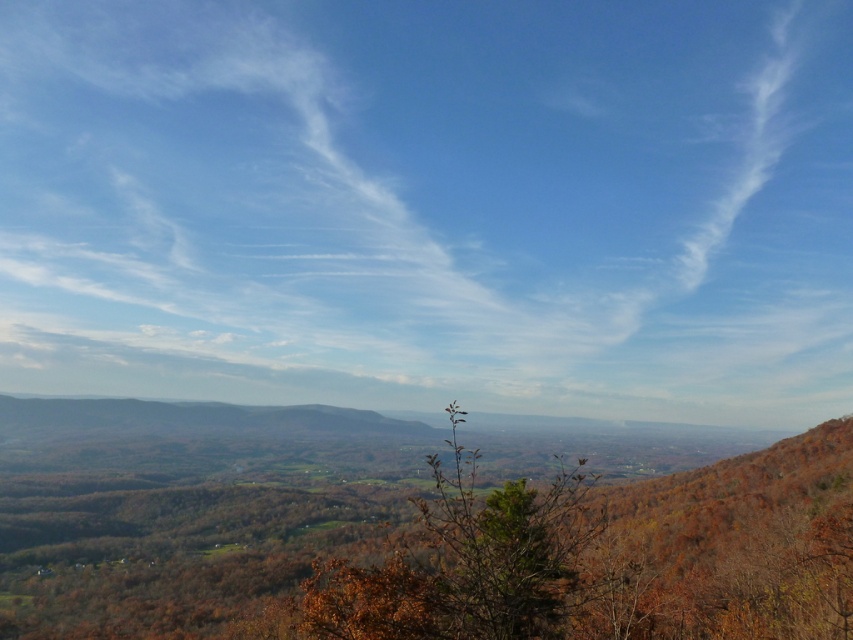
Is white cotton cloud at upper center positioned before brown leafy tree at center?

No, white cotton cloud at upper center is behind brown leafy tree at center.

Who is positioned more to the left, white cotton cloud at upper center or brown leafy tree at center?

From the viewer's perspective, brown leafy tree at center appears more on the left side.

Is point (527, 376) behind point (819, 476)?

Yes, it is behind point (819, 476).

Where is `white cotton cloud at upper center`? white cotton cloud at upper center is located at coordinates (431, 205).